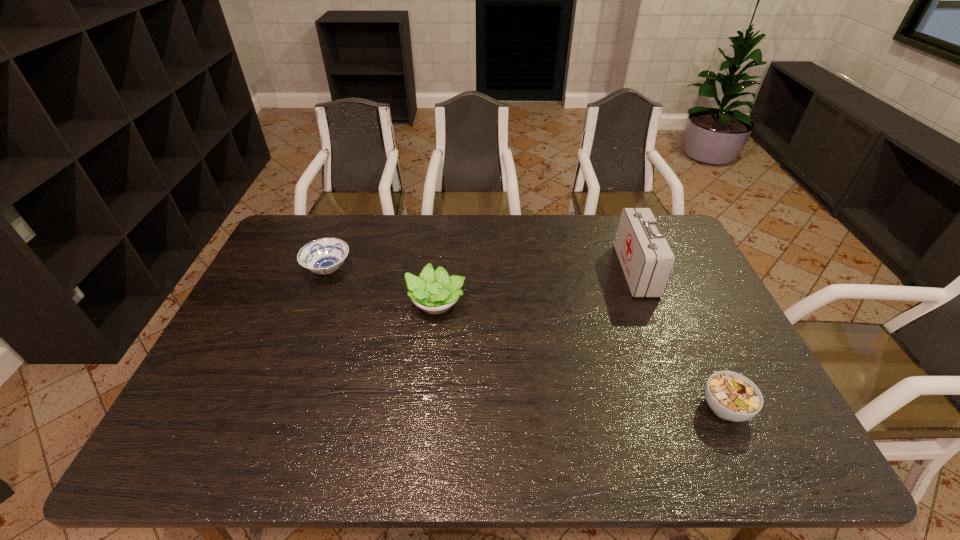
In order to click on free space that satisfies the following two spatial constraints: 1. on the front side of the nearer soup bowl; 2. on the right side of the leftmost object in this screenshot , I will do point(275,408).

Image resolution: width=960 pixels, height=540 pixels. I want to click on vacant space that satisfies the following two spatial constraints: 1. on the front-facing side of the nearest object; 2. on the right side of the first-aid kit, so click(690, 408).

Identify the location of free space that satisfies the following two spatial constraints: 1. on the front-facing side of the first-aid kit; 2. on the left side of the right soup bowl. This screenshot has height=540, width=960. (690, 408).

This screenshot has height=540, width=960. Find the location of `free space that satisfies the following two spatial constraints: 1. on the front side of the second object from left to right; 2. on the left side of the leftmost object`. free space that satisfies the following two spatial constraints: 1. on the front side of the second object from left to right; 2. on the left side of the leftmost object is located at coordinates (316, 302).

The height and width of the screenshot is (540, 960). Identify the location of blank space that satisfies the following two spatial constraints: 1. on the front-facing side of the nearest object; 2. on the left side of the first-aid kit. (690, 408).

Find the location of a particular element. free space that satisfies the following two spatial constraints: 1. on the back side of the right soup bowl; 2. on the front-facing side of the first-aid kit is located at coordinates (661, 271).

You are a GUI agent. You are given a task and a screenshot of the screen. Output one action in this format:
    pyautogui.click(x=<x>, y=<y>)
    Task: Click on the vacant space that satisfies the following two spatial constraints: 1. on the front-facing side of the tallest object; 2. on the front side of the second object from left to right
    The image size is (960, 540).
    Given the screenshot: What is the action you would take?
    pyautogui.click(x=649, y=302)

At what (x,y) coordinates should I click in order to perform the action: click on free space that satisfies the following two spatial constraints: 1. on the front side of the left soup bowl; 2. on the left side of the lettuce. Please return your answer as a coordinate pair (x, y). The width and height of the screenshot is (960, 540). Looking at the image, I should click on (316, 302).

Locate an element on the screen. vacant space that satisfies the following two spatial constraints: 1. on the front-facing side of the first-aid kit; 2. on the left side of the nearer soup bowl is located at coordinates (690, 408).